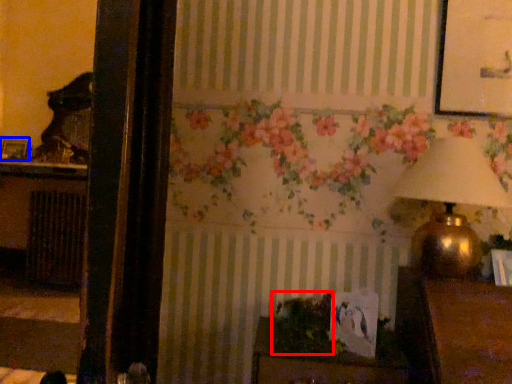
Question: Which object appears closest to the camera in this image, plant (highlighted by a red box) or picture frame (highlighted by a blue box)?

Choices:
 (A) plant
 (B) picture frame

Answer: (A)